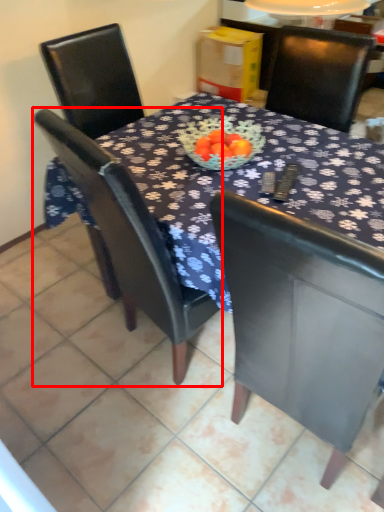
Question: From the image's perspective, what is the correct spatial relationship of chair (annotated by the red box) in relation to chair?

Choices:
 (A) above
 (B) below

Answer: (A)